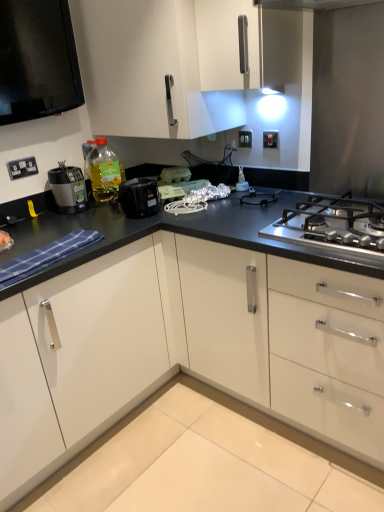
Question: Should I look upward or downward to see translucent yellow bottle at upper left?

Choices:
 (A) down
 (B) up

Answer: (B)

Question: Considering the relative positions of matte plastic kettle at center, which appears as the first appliance when viewed from the right, and white plastic electric outlet at upper center, which is counted as the first electric outlet, starting from the back, in the image provided, is matte plastic kettle at center, which appears as the first appliance when viewed from the right, to the left of white plastic electric outlet at upper center, which is counted as the first electric outlet, starting from the back, from the viewer's perspective?

Choices:
 (A) yes
 (B) no

Answer: (A)

Question: Is matte plastic kettle at center, the third appliance when ordered from left to right, facing towards white plastic electric outlet at upper center, which is counted as the first electric outlet, starting from the back?

Choices:
 (A) yes
 (B) no

Answer: (B)

Question: Is matte plastic kettle at center, which appears as the first appliance when viewed from the right, closer to camera compared to white plastic electric outlet at upper center, marked as the third electric outlet in a front-to-back arrangement?

Choices:
 (A) no
 (B) yes

Answer: (B)

Question: Does matte plastic kettle at center, which appears as the first appliance when viewed from the right, have a smaller size compared to white plastic electric outlet at upper center, marked as the third electric outlet in a front-to-back arrangement?

Choices:
 (A) no
 (B) yes

Answer: (A)

Question: From the image's perspective, is matte plastic kettle at center, which appears as the first appliance when viewed from the right, on white plastic electric outlet at upper center, the second electric outlet from the right?

Choices:
 (A) yes
 (B) no

Answer: (B)

Question: Would you say matte plastic kettle at center, which appears as the first appliance when viewed from the right, is outside white plastic electric outlet at upper center, the second electric outlet from the right?

Choices:
 (A) yes
 (B) no

Answer: (A)

Question: Are white plastic electric outlet at upper center, the second electric outlet from the right, and translucent yellow bottle at upper left far apart?

Choices:
 (A) no
 (B) yes

Answer: (A)

Question: Would you say translucent yellow bottle at upper left is part of white plastic electric outlet at upper center, the second electric outlet from the right,'s contents?

Choices:
 (A) yes
 (B) no

Answer: (B)

Question: Can you confirm if white plastic electric outlet at upper center, the second electric outlet from the right, is taller than translucent yellow bottle at upper left?

Choices:
 (A) yes
 (B) no

Answer: (B)

Question: From a real-world perspective, is white plastic electric outlet at upper center, the second electric outlet from the right, beneath translucent yellow bottle at upper left?

Choices:
 (A) no
 (B) yes

Answer: (A)

Question: Is white plastic electric outlet at upper center, the second electric outlet from the right, further to the viewer compared to translucent yellow bottle at upper left?

Choices:
 (A) yes
 (B) no

Answer: (A)

Question: From a real-world perspective, is white plastic electric outlet at upper center, marked as the 1th electric outlet in a top-to-bottom arrangement, on top of translucent yellow bottle at upper left?

Choices:
 (A) yes
 (B) no

Answer: (A)

Question: From a real-world perspective, does white plastic electrical outlet at upper left, marked as the 3th electric outlet in a back-to-front arrangement, stand above stainless steel gas stove at right?

Choices:
 (A) no
 (B) yes

Answer: (B)